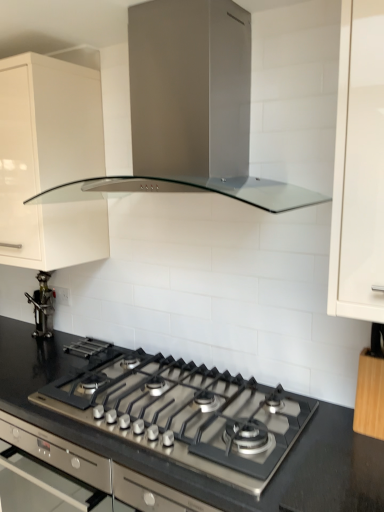
Image resolution: width=384 pixels, height=512 pixels. I want to click on black granite countertop at center, so tap(186, 431).

Locate an element on the screen. metallic figurine at left is located at coordinates (42, 305).

Locate an element on the screen. The height and width of the screenshot is (512, 384). wooden knife block at right, which appears as the second cabinetry when viewed from the left is located at coordinates (369, 396).

The image size is (384, 512). I want to click on satin silver oven at center, so [97, 469].

Is satin silver range hood at upper center outside of wooden knife block at right, which ranks as the second cabinetry in back-to-front order?

Yes, satin silver range hood at upper center is not within wooden knife block at right, which ranks as the second cabinetry in back-to-front order.

From the picture: Is satin silver range hood at upper center oriented away from wooden knife block at right, marked as the first cabinetry in a front-to-back arrangement?

No, wooden knife block at right, marked as the first cabinetry in a front-to-back arrangement, is not at the back of satin silver range hood at upper center.

Is metallic figurine at left outside of white glossy cabinet at upper left, which appears as the first cabinetry when viewed from the back?

metallic figurine at left is positioned outside white glossy cabinet at upper left, which appears as the first cabinetry when viewed from the back.

From the image's perspective, between metallic figurine at left and white glossy cabinet at upper left, which appears as the first cabinetry when viewed from the top, which one is located above?

white glossy cabinet at upper left, which appears as the first cabinetry when viewed from the top, appears higher in the image.

Can you confirm if metallic figurine at left is shorter than white glossy cabinet at upper left, which appears as the first cabinetry when viewed from the back?

Correct, metallic figurine at left is not as tall as white glossy cabinet at upper left, which appears as the first cabinetry when viewed from the back.

From a real-world perspective, is metallic figurine at left over white glossy cabinet at upper left, which is the second cabinetry in right-to-left order?

No.

Considering the sizes of objects satin silver range hood at upper center and black granite countertop at center in the image provided, who is taller, satin silver range hood at upper center or black granite countertop at center?

satin silver range hood at upper center is taller.

Looking at this image, from a real-world perspective, which object rests below the other?

black granite countertop at center is physically lower.

Is there a large distance between satin silver range hood at upper center and black granite countertop at center?

No.

In terms of width, does satin silver range hood at upper center look wider or thinner when compared to black granite countertop at center?

satin silver range hood at upper center is thinner than black granite countertop at center.

From the image's perspective, is wooden knife block at right, marked as the first cabinetry in a front-to-back arrangement, on white glossy cabinet at upper left, the first cabinetry from the left?

Incorrect, from the image's perspective, wooden knife block at right, marked as the first cabinetry in a front-to-back arrangement, is lower than white glossy cabinet at upper left, the first cabinetry from the left.

Can you tell me how much wooden knife block at right, marked as the first cabinetry in a front-to-back arrangement, and white glossy cabinet at upper left, the first cabinetry from the left, differ in facing direction?

The angular difference between wooden knife block at right, marked as the first cabinetry in a front-to-back arrangement, and white glossy cabinet at upper left, the first cabinetry from the left, is 0.32 degrees.

Considering the relative sizes of wooden knife block at right, arranged as the 2th cabinetry when viewed from the top, and white glossy cabinet at upper left, which is the second cabinetry in right-to-left order, in the image provided, is wooden knife block at right, arranged as the 2th cabinetry when viewed from the top, shorter than white glossy cabinet at upper left, which is the second cabinetry in right-to-left order,?

Indeed, wooden knife block at right, arranged as the 2th cabinetry when viewed from the top, has a lesser height compared to white glossy cabinet at upper left, which is the second cabinetry in right-to-left order.

Which is behind, point (375, 405) or point (81, 100)?

Point (81, 100)

Is black granite countertop at center placed right next to white glossy cabinet at upper left, which is the second cabinetry from front to back?

black granite countertop at center and white glossy cabinet at upper left, which is the second cabinetry from front to back, are not in contact.

Is black granite countertop at center oriented away from white glossy cabinet at upper left, which appears as the first cabinetry when viewed from the top?

No, black granite countertop at center is not facing the opposite direction of white glossy cabinet at upper left, which appears as the first cabinetry when viewed from the top.

Is point (223, 422) closer or farther from the camera than point (30, 261)?

Point (223, 422) is positioned closer to the camera compared to point (30, 261).

Is black granite countertop at center smaller than white glossy cabinet at upper left, which appears as the first cabinetry when viewed from the back?

Correct, black granite countertop at center occupies less space than white glossy cabinet at upper left, which appears as the first cabinetry when viewed from the back.

Based on the photo, considering the positions of objects satin silver range hood at upper center and satin silver oven at center in the image provided, who is more to the left, satin silver range hood at upper center or satin silver oven at center?

satin silver oven at center.

Is satin silver range hood at upper center beside satin silver oven at center?

No, satin silver range hood at upper center is not in contact with satin silver oven at center.

Considering the relative sizes of satin silver range hood at upper center and satin silver oven at center in the image provided, is satin silver range hood at upper center taller than satin silver oven at center?

Yes, satin silver range hood at upper center is taller than satin silver oven at center.

Which of these two, metallic figurine at left or satin silver oven at center, is smaller?

Smaller between the two is metallic figurine at left.

How much distance is there between metallic figurine at left and satin silver oven at center?

metallic figurine at left is 27.13 inches from satin silver oven at center.

Could you tell me if metallic figurine at left is facing satin silver oven at center?

No, metallic figurine at left does not turn towards satin silver oven at center.

Consider the image. Is metallic figurine at left completely or partially outside of satin silver oven at center?

Yes.

Locate an element on the screen. The width and height of the screenshot is (384, 512). home appliance in front of the wooden knife block at right, which appears as the second cabinetry when viewed from the left is located at coordinates (190, 109).

Image resolution: width=384 pixels, height=512 pixels. Find the location of `appliance that appears below the white glossy cabinet at upper left, which is the second cabinetry from front to back (from a real-world perspective)`. appliance that appears below the white glossy cabinet at upper left, which is the second cabinetry from front to back (from a real-world perspective) is located at coordinates (42, 305).

From the image, which object appears to be farther from metallic figurine at left, satin silver oven at center or satin silver range hood at upper center?

Based on the image, satin silver range hood at upper center appears to be further to metallic figurine at left.

Considering their positions, is wooden knife block at right, which ranks as the second cabinetry in back-to-front order, positioned closer to satin silver range hood at upper center than black granite countertop at center?

Among the two, black granite countertop at center is located nearer to satin silver range hood at upper center.

When comparing their distances from metallic figurine at left, does black granite countertop at center or white glossy cabinet at upper left, which is the second cabinetry from front to back, seem closer?

Based on the image, white glossy cabinet at upper left, which is the second cabinetry from front to back, appears to be nearer to metallic figurine at left.

From the image, which object appears to be nearer to satin silver oven at center, black granite countertop at center or metallic figurine at left?

black granite countertop at center lies closer to satin silver oven at center than the other object.

From the image, which object appears to be nearer to black granite countertop at center, satin silver oven at center or wooden knife block at right, the 1th cabinetry positioned from the right?

satin silver oven at center is closer to black granite countertop at center.

When comparing their distances from metallic figurine at left, does white glossy cabinet at upper left, which is the second cabinetry from front to back, or wooden knife block at right, marked as the first cabinetry in a front-to-back arrangement, seem further?

Among the two, wooden knife block at right, marked as the first cabinetry in a front-to-back arrangement, is located further to metallic figurine at left.

Based on their spatial positions, is black granite countertop at center or satin silver oven at center further from wooden knife block at right, the 1th cabinetry when ordered from bottom to top?

satin silver oven at center lies further to wooden knife block at right, the 1th cabinetry when ordered from bottom to top, than the other object.

When comparing their distances from metallic figurine at left, does satin silver range hood at upper center or satin silver oven at center seem closer?

satin silver oven at center lies closer to metallic figurine at left than the other object.

Locate an element on the screen. The width and height of the screenshot is (384, 512). countertop situated between metallic figurine at left and wooden knife block at right, the 1th cabinetry when ordered from bottom to top, from left to right is located at coordinates (x=186, y=431).

The height and width of the screenshot is (512, 384). In order to click on home appliance between white glossy cabinet at upper left, the first cabinetry from the left, and wooden knife block at right, the 1th cabinetry when ordered from bottom to top, from left to right in this screenshot , I will do tap(190, 109).

Find the location of a particular element. home appliance situated between metallic figurine at left and wooden knife block at right, marked as the first cabinetry in a front-to-back arrangement, from left to right is located at coordinates click(x=190, y=109).

Image resolution: width=384 pixels, height=512 pixels. I want to click on appliance between white glossy cabinet at upper left, which is the second cabinetry in right-to-left order, and wooden knife block at right, marked as the first cabinetry in a front-to-back arrangement, in the horizontal direction, so click(42, 305).